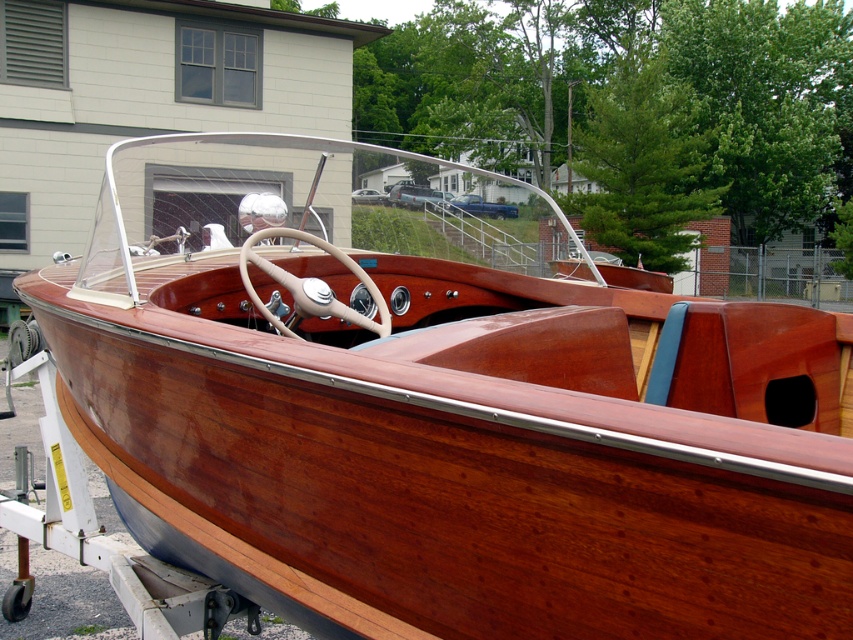
Can you confirm if blue metallic truck at center is taller than metallic silver car at center?

Indeed, blue metallic truck at center has a greater height compared to metallic silver car at center.

Between point (480, 212) and point (389, 202), which one is positioned behind?

The point (389, 202) is behind.

Is point (505, 209) closer to camera compared to point (376, 189)?

That is True.

Locate an element on the screen. blue metallic truck at center is located at coordinates (483, 205).